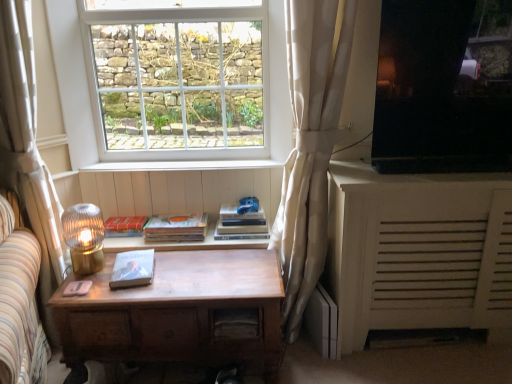
At what (x,y) coordinates should I click in order to perform the action: click on vacant space situated above white wood at center (from a real-world perspective). Please return your answer as a coordinate pair (x, y). Image resolution: width=512 pixels, height=384 pixels. Looking at the image, I should click on (163, 163).